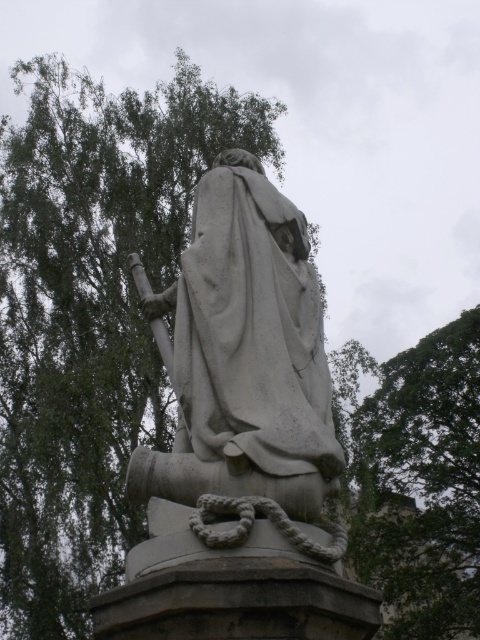
Between green leafy tree at upper left and green leafy tree at upper right, which one appears on the left side from the viewer's perspective?

From the viewer's perspective, green leafy tree at upper left appears more on the left side.

Can you confirm if green leafy tree at upper left is positioned below green leafy tree at upper right?

Actually, green leafy tree at upper left is above green leafy tree at upper right.

The width and height of the screenshot is (480, 640). What are the coordinates of `green leafy tree at upper left` in the screenshot? It's located at (91, 316).

Find the location of a particular element. green leafy tree at upper left is located at coordinates (91, 316).

Is white stone statue at center positioned in front of green leafy tree at upper right?

That is True.

Can you confirm if white stone statue at center is smaller than green leafy tree at upper right?

Correct, white stone statue at center occupies less space than green leafy tree at upper right.

The height and width of the screenshot is (640, 480). What do you see at coordinates (245, 369) in the screenshot?
I see `white stone statue at center` at bounding box center [245, 369].

The height and width of the screenshot is (640, 480). I want to click on white stone statue at center, so click(x=245, y=369).

Is green leafy tree at upper left behind white stone statue at center?

Yes, green leafy tree at upper left is further from the viewer.

Can you confirm if green leafy tree at upper left is bigger than white stone statue at center?

Yes, green leafy tree at upper left is bigger than white stone statue at center.

Locate an element on the screen. The width and height of the screenshot is (480, 640). green leafy tree at upper left is located at coordinates (91, 316).